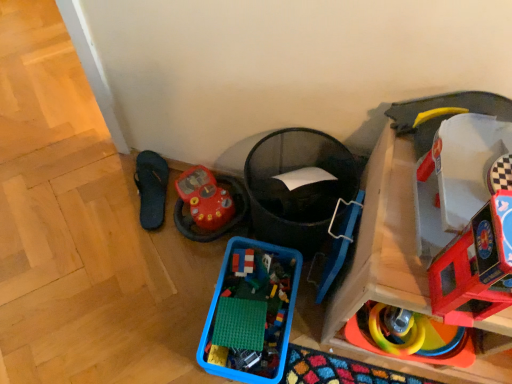
This screenshot has width=512, height=384. In order to click on empty space that is ontop of rubberized plastic rings at lower right, marked as the 3th toy in a right-to-left arrangement (from a real-world perspective) in this screenshot , I will do `click(405, 327)`.